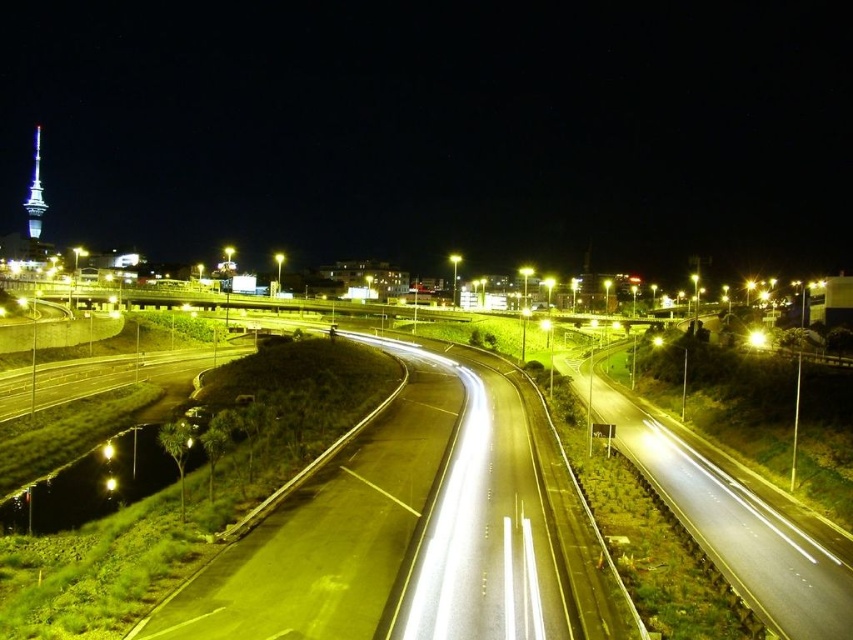
Question: Can you confirm if yellow asphalt highway at center is smaller than yellow metallic light at center?

Choices:
 (A) yes
 (B) no

Answer: (B)

Question: Does yellow asphalt highway at center have a larger size compared to yellow metallic streetlight at right?

Choices:
 (A) no
 (B) yes

Answer: (B)

Question: Which object is the farthest from the yellow asphalt highway at center?

Choices:
 (A) shiny blue tower at upper left
 (B) yellow metallic streetlight at right

Answer: (A)

Question: Is black asphalt highway at center closer to the viewer compared to shiny blue tower at upper left?

Choices:
 (A) yes
 (B) no

Answer: (A)

Question: Based on their relative distances, which object is farther from the yellow metallic light at center?

Choices:
 (A) black asphalt highway at center
 (B) yellow metallic streetlight at right
 (C) shiny blue tower at upper left
 (D) yellow asphalt highway at center

Answer: (C)

Question: Which point appears closest to the camera in this image?

Choices:
 (A) (39, 208)
 (B) (792, 618)

Answer: (B)